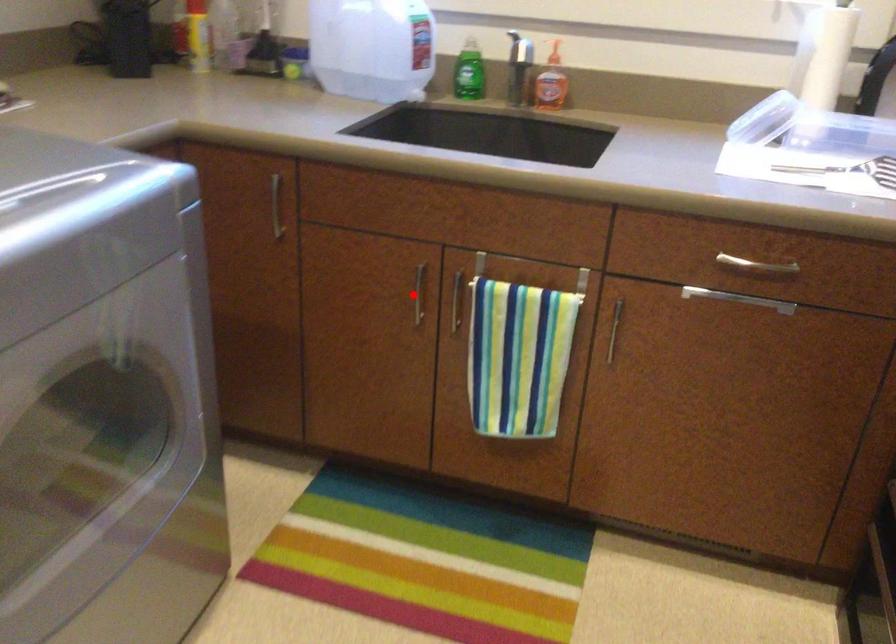
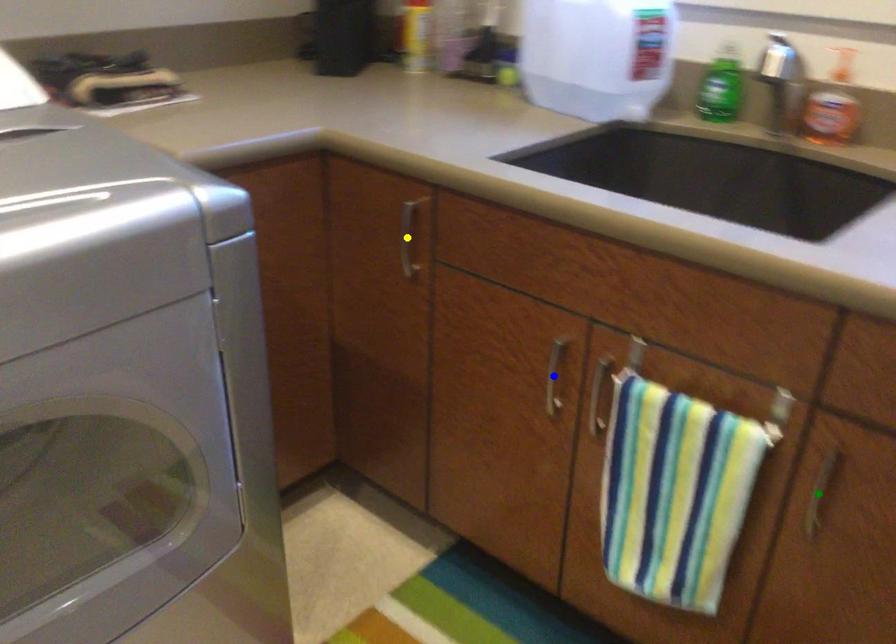
Question: I am providing you with two images of the same scene from different viewpoints. A red point is marked on the first image. You are given multiple points on the second image. Which point in image 2 represents the same 3d spot as the red point in image 1?

Choices:
 (A) yellow point
 (B) blue point
 (C) green point

Answer: (B)